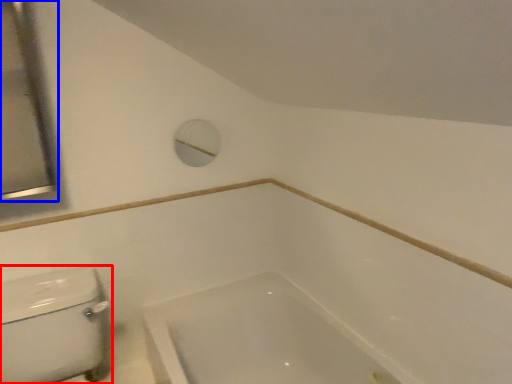
Question: Which object appears farthest to the camera in this image, porcelain (highlighted by a red box) or mirror (highlighted by a blue box)?

Choices:
 (A) porcelain
 (B) mirror

Answer: (B)